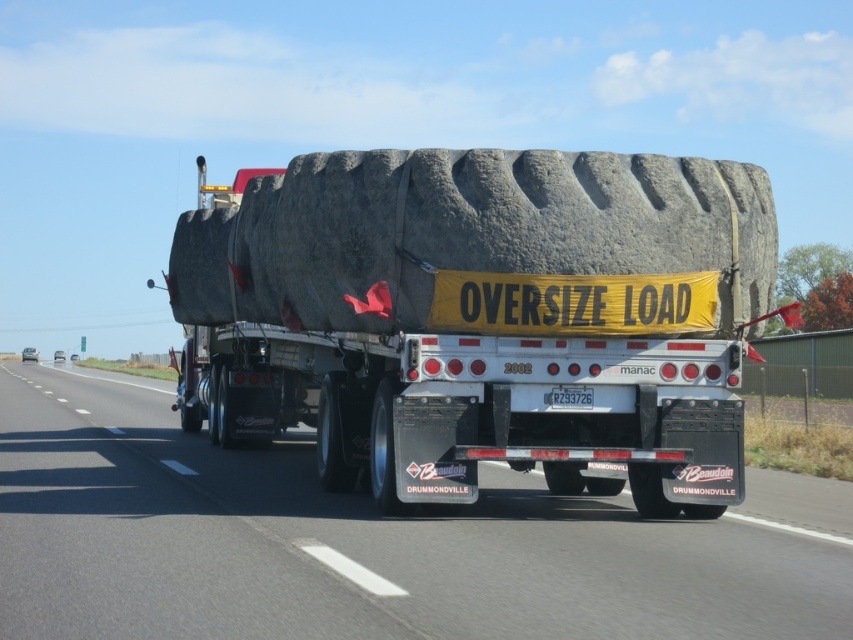
Question: Does rubber tire at center have a greater width compared to black rubber tire at center?

Choices:
 (A) no
 (B) yes

Answer: (A)

Question: Does rubber tire at center come behind black rubber tire at center?

Choices:
 (A) yes
 (B) no

Answer: (A)

Question: Which point is closer to the camera taking this photo?

Choices:
 (A) (73, 422)
 (B) (380, 476)

Answer: (B)

Question: Which of the following is the farthest from the observer?

Choices:
 (A) (582, 282)
 (B) (206, 577)

Answer: (A)

Question: Observing the image, what is the correct spatial positioning of rubber tire at center in reference to black rubber tire at center?

Choices:
 (A) above
 (B) below

Answer: (A)